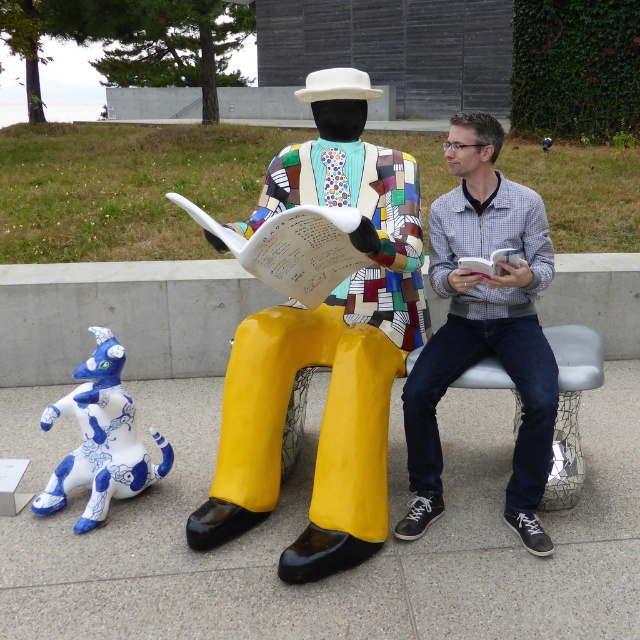
You are standing in front of the sculpture and want to touch both the matte gray shirt at center and the blue glossy ceramic dog at lower left. Which one can you reach first without moving your position?

The matte gray shirt at center is closer to the viewer than the blue glossy ceramic dog at lower left, so you can reach it first without moving.

You are an art student analyzing the outdoor scene. You notice the matte multicolored suit at center and the blue glossy ceramic dog at lower left. Which object is closer to the viewer?

The matte multicolored suit at center is closer to the viewer because it is positioned over the blue glossy ceramic dog at lower left.